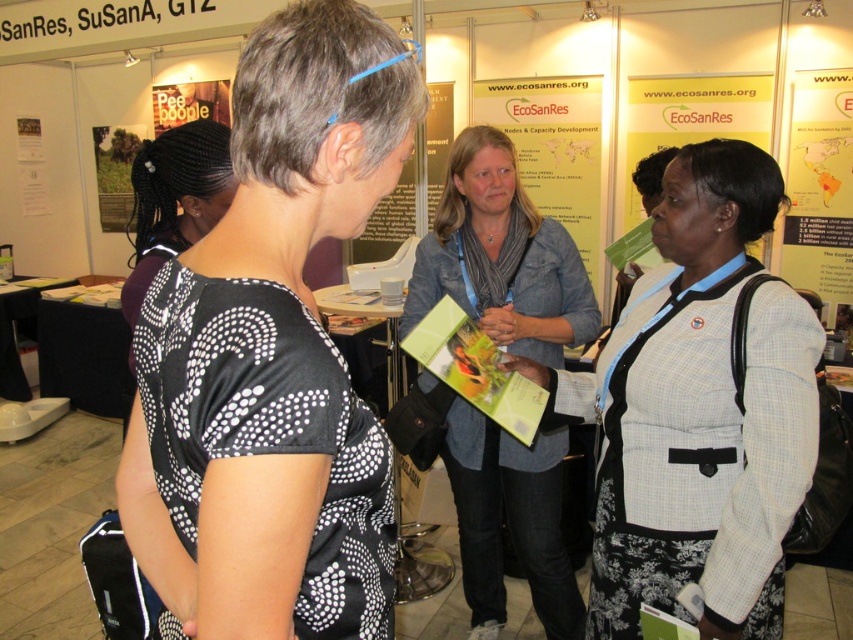
Who is more distant from viewer, (410,408) or (637,125)?

Point (637,125)

Looking at this image, is denim jacket at center below matte green paper at center?

Correct, denim jacket at center is located below matte green paper at center.

Locate an element on the screen. The image size is (853, 640). denim jacket at center is located at coordinates (500, 257).

Does black dotted fabric shirt at center appear on the right side of white textured blazer at center?

No, black dotted fabric shirt at center is not to the right of white textured blazer at center.

Who is more forward, (138,534) or (772,554)?

Positioned in front is point (138,534).

The height and width of the screenshot is (640, 853). Identify the location of black dotted fabric shirt at center. pyautogui.click(x=273, y=356).

Who is more forward, (689, 193) or (421, 237)?

Point (689, 193)

This screenshot has height=640, width=853. In order to click on white textured blazer at center in this screenshot , I will do `click(698, 412)`.